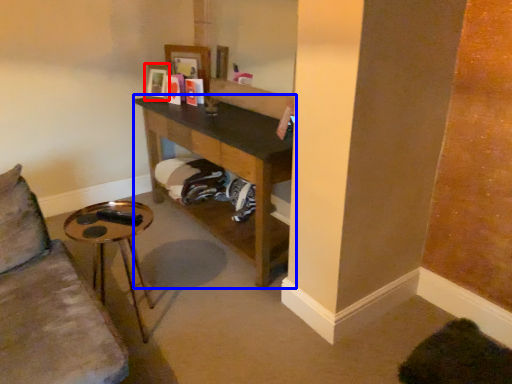
Question: Which object appears closest to the camera in this image, picture frame (highlighted by a red box) or shelf (highlighted by a blue box)?

Choices:
 (A) picture frame
 (B) shelf

Answer: (B)